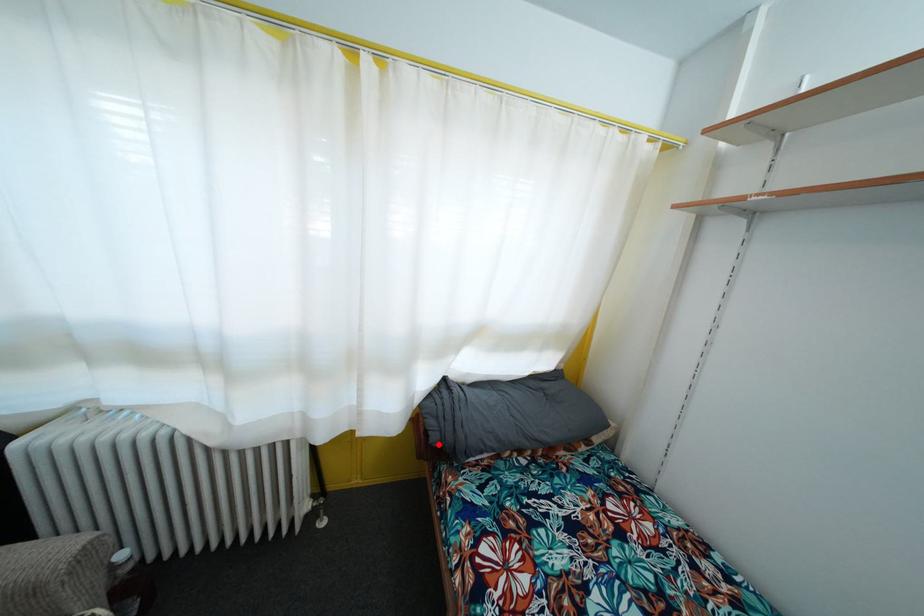
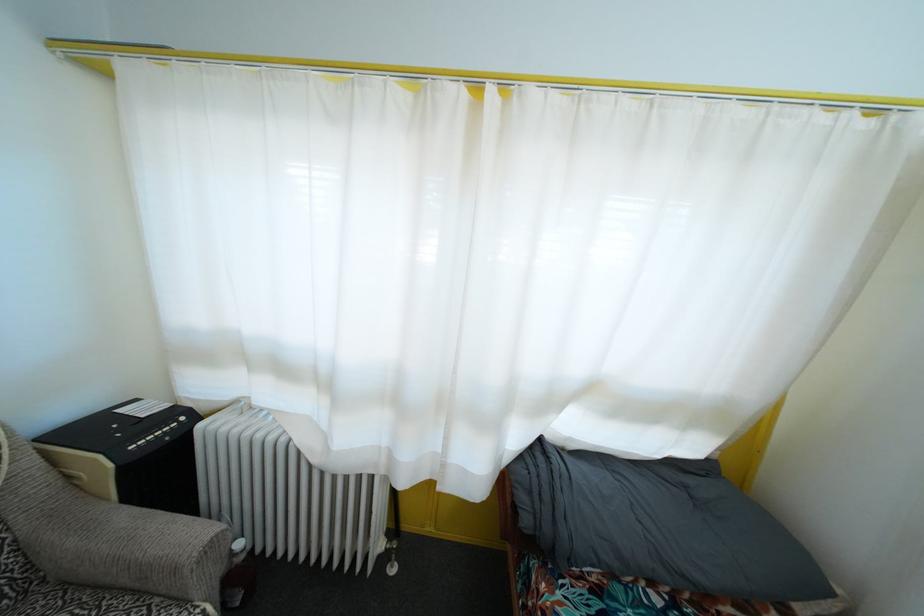
Where in the second image is the point corresponding to the highlighted location from the first image?

(529, 528)